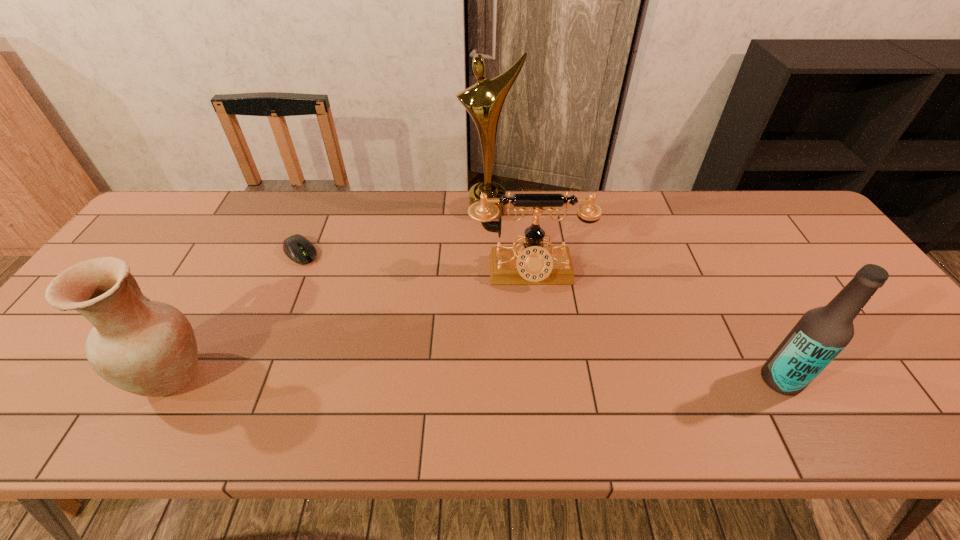
Locate an element on the screen. The image size is (960, 540). free space between the tallest object and the rightmost object is located at coordinates (635, 295).

Locate an element on the screen. free space between the pottery and the computer mouse is located at coordinates click(x=237, y=314).

Where is `unoccupied area between the telephone and the leftmost object`? The width and height of the screenshot is (960, 540). unoccupied area between the telephone and the leftmost object is located at coordinates (351, 324).

Identify the location of unoccupied position between the rightmost object and the tallest object. (635, 295).

Identify the location of empty space between the beer bottle and the pottery. (477, 377).

At what (x,y) coordinates should I click in order to perform the action: click on free area in between the tallest object and the computer mouse. Please return your answer as a coordinate pair (x, y). This screenshot has height=540, width=960. Looking at the image, I should click on (395, 231).

This screenshot has height=540, width=960. Identify the location of empty space that is in between the leftmost object and the beer bottle. (477, 377).

This screenshot has width=960, height=540. I want to click on vacant area between the second shortest object and the computer mouse, so click(x=415, y=262).

Find the location of a particular element. vacant space in between the telephone and the tallest object is located at coordinates (509, 241).

This screenshot has height=540, width=960. I want to click on object identified as the third closest to the shortest object, so click(x=532, y=263).